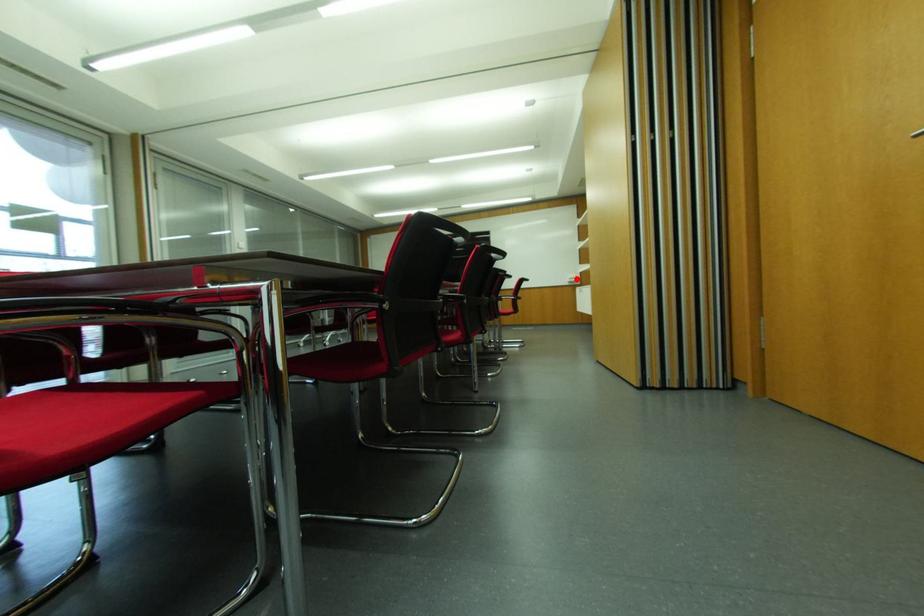
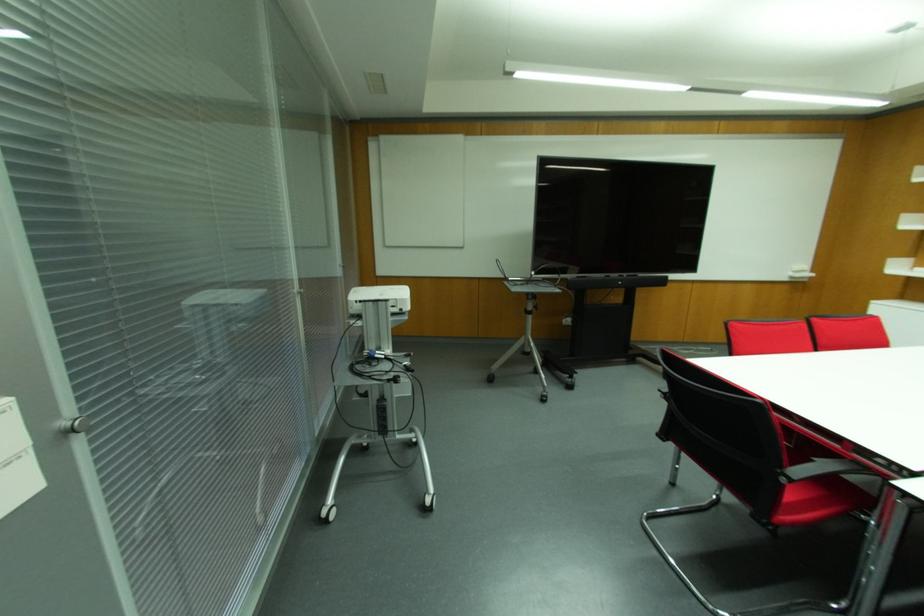
Find the pixel in the second image that matches the highlighted location in the first image.

(811, 274)